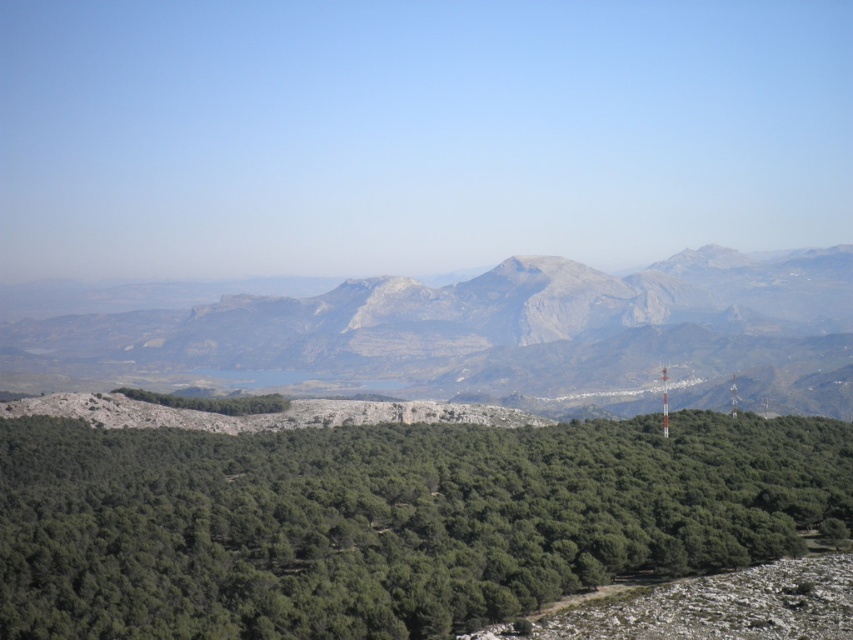
Question: Which of the following is the farthest from the observer?

Choices:
 (A) green leafy trees at center
 (B) rugged stone mountain range at center

Answer: (B)

Question: From the image, what is the correct spatial relationship of green leafy trees at center in relation to rugged stone mountain range at center?

Choices:
 (A) left
 (B) right

Answer: (A)

Question: Among these objects, which one is nearest to the camera?

Choices:
 (A) green leafy trees at center
 (B) rugged stone mountain range at center

Answer: (A)

Question: Is green leafy trees at center smaller than rugged stone mountain range at center?

Choices:
 (A) yes
 (B) no

Answer: (A)

Question: Which point appears farthest from the camera in this image?

Choices:
 (A) (264, 371)
 (B) (49, 474)

Answer: (A)

Question: Can you confirm if green leafy trees at center is positioned above rugged stone mountain range at center?

Choices:
 (A) yes
 (B) no

Answer: (B)